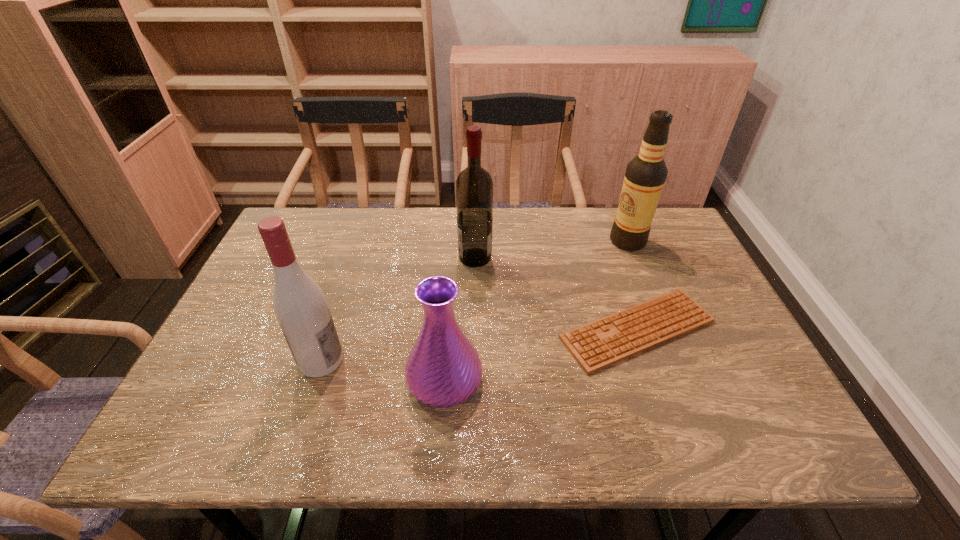
Locate an element on the screen. The height and width of the screenshot is (540, 960). free space located on the label of the leftmost object is located at coordinates (500, 360).

Where is `vacant space located on the right of the vase`? This screenshot has height=540, width=960. vacant space located on the right of the vase is located at coordinates (641, 380).

Locate an element on the screen. vacant space located on the left of the shortest object is located at coordinates (443, 329).

You are a GUI agent. You are given a task and a screenshot of the screen. Output one action in this format:
    pyautogui.click(x=<x>, y=<y>)
    Task: Click on the object that is at the near edge
    This screenshot has height=540, width=960.
    Given the screenshot: What is the action you would take?
    pyautogui.click(x=443, y=369)

The width and height of the screenshot is (960, 540). Find the location of `alcohol situated at the right edge`. alcohol situated at the right edge is located at coordinates 645,176.

Locate an element on the screen. This screenshot has height=540, width=960. computer keyboard that is at the right edge is located at coordinates (596, 345).

Image resolution: width=960 pixels, height=540 pixels. I want to click on object located in the far right corner section of the desktop, so click(645, 176).

This screenshot has width=960, height=540. I want to click on vacant region at the far edge of the desktop, so click(x=442, y=251).

Locate an element on the screen. The image size is (960, 540). free spot at the near edge of the desktop is located at coordinates (371, 435).

You are a GUI agent. You are given a task and a screenshot of the screen. Output one action in this format:
    pyautogui.click(x=<x>, y=<y>)
    Task: Click on the free location at the left edge of the desktop
    The width and height of the screenshot is (960, 540).
    Given the screenshot: What is the action you would take?
    pyautogui.click(x=257, y=327)